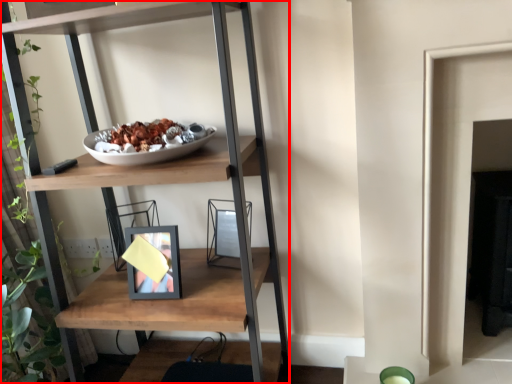
Question: From the image's perspective, where is shelf (annotated by the red box) located relative to picture frame?

Choices:
 (A) above
 (B) below

Answer: (A)